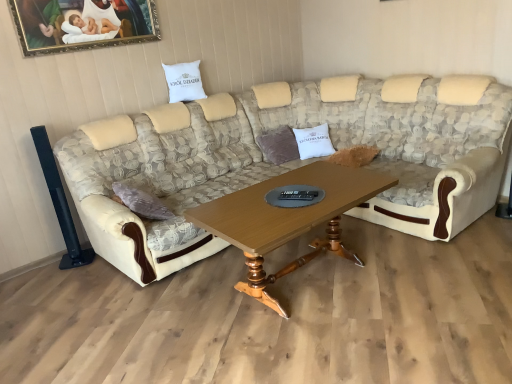
At what (x,y) coordinates should I click in order to perform the action: click on vacant area that is in front of woodenwoodencoffee table at center. Please return your answer as a coordinate pair (x, y). Image resolution: width=512 pixels, height=384 pixels. Looking at the image, I should click on (343, 344).